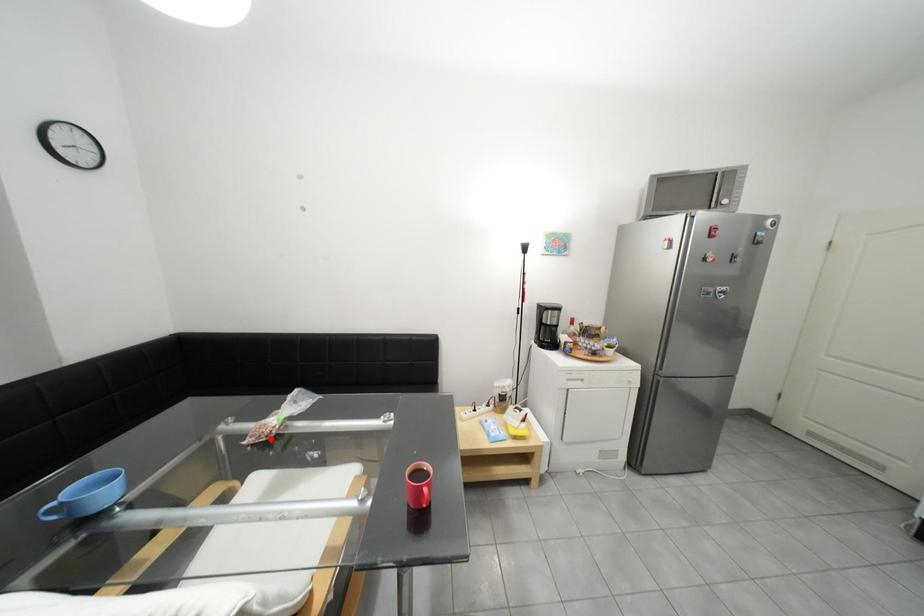
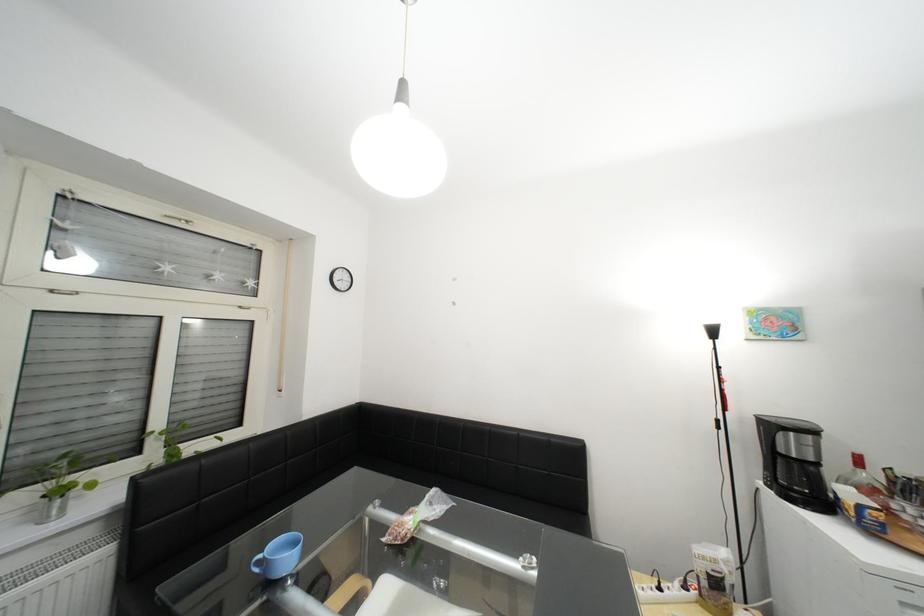
Question: I am providing you with two images of the same scene from different viewpoints. In image1, a red point is highlighted. Considering the same 3D point in image2, which of the following is correct?

Choices:
 (A) It is closer
 (B) It is farther

Answer: (B)